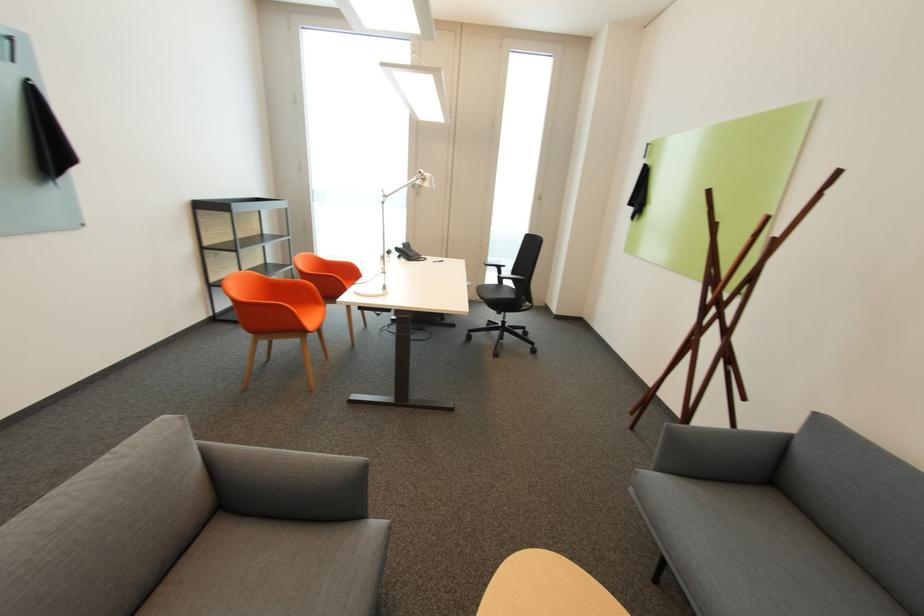
Image resolution: width=924 pixels, height=616 pixels. What do you see at coordinates (407, 252) in the screenshot?
I see `the telephone handset` at bounding box center [407, 252].